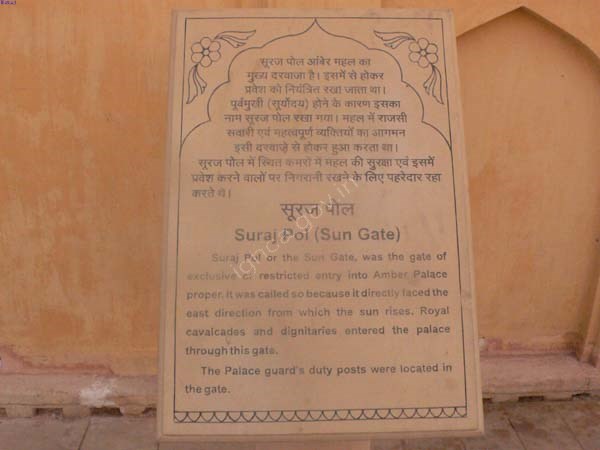
Locate an element on the screen. The height and width of the screenshot is (450, 600). spaces under the wall border is located at coordinates coord(47,410), coord(109,412), coord(486,401), coord(534,399), coord(584,393).